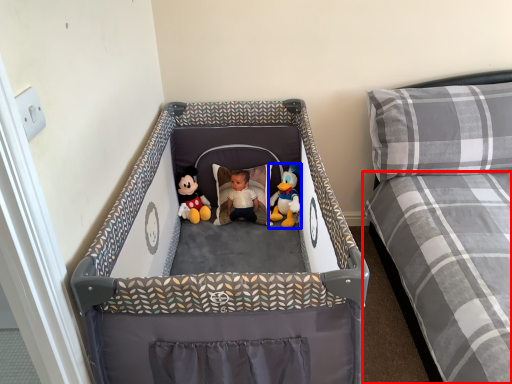
Question: Which of the following is the farthest to the observer, mattress (highlighted by a red box) or toy (highlighted by a blue box)?

Choices:
 (A) mattress
 (B) toy

Answer: (B)